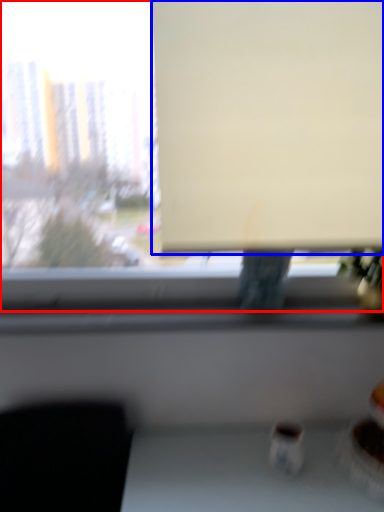
Question: Which of the following is the farthest to the observer, window (highlighted by a red box) or projection screen (highlighted by a blue box)?

Choices:
 (A) window
 (B) projection screen

Answer: (B)